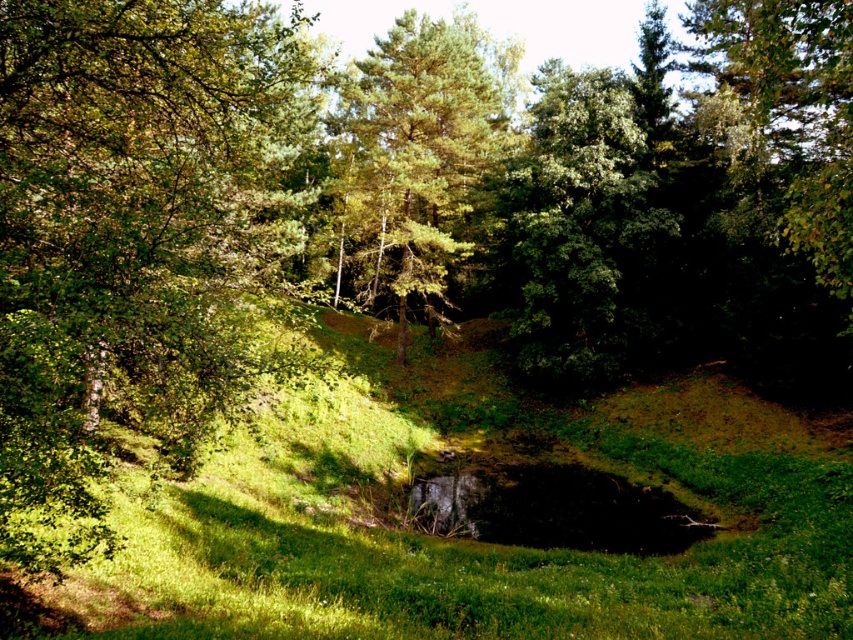
Which is behind, point (201, 106) or point (387, 152)?

Positioned behind is point (387, 152).

Measure the distance between green leafy tree at left and camera.

They are 19.46 feet apart.

Locate an element on the screen. The width and height of the screenshot is (853, 640). green leafy tree at left is located at coordinates 136,237.

Locate an element on the screen. Image resolution: width=853 pixels, height=640 pixels. green grass at center is located at coordinates (469, 513).

Based on the photo, does green grass at center have a lesser height compared to green leafy tree at left?

Indeed, green grass at center has a lesser height compared to green leafy tree at left.

Is point (144, 621) behind point (132, 369)?

That is True.

The width and height of the screenshot is (853, 640). Find the location of `green grass at center`. green grass at center is located at coordinates (469, 513).

Does point (287, 208) come farther from viewer compared to point (643, 136)?

That is False.

Which is more to the right, green leafy tree at left or green leafy tree at center?

green leafy tree at center

Which is in front, point (299, 115) or point (561, 177)?

Point (299, 115)

The width and height of the screenshot is (853, 640). Identify the location of green leafy tree at left. (136, 237).